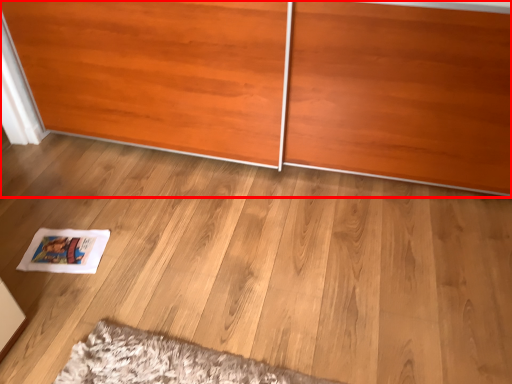
Question: In this image, where is furniture (annotated by the red box) located relative to magazine?

Choices:
 (A) right
 (B) left

Answer: (A)